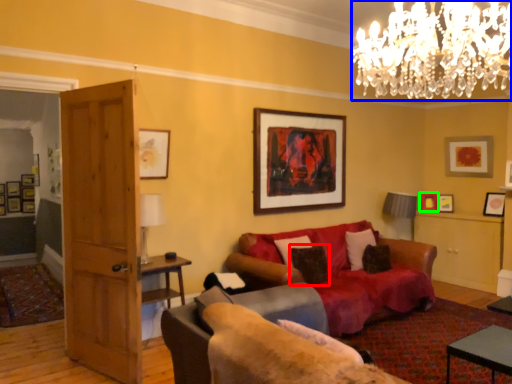
Question: Which object is the farthest from pillow (highlighted by a red box)? Choose among these: lamp (highlighted by a blue box) or picture frame (highlighted by a green box).

Choices:
 (A) lamp
 (B) picture frame

Answer: (B)